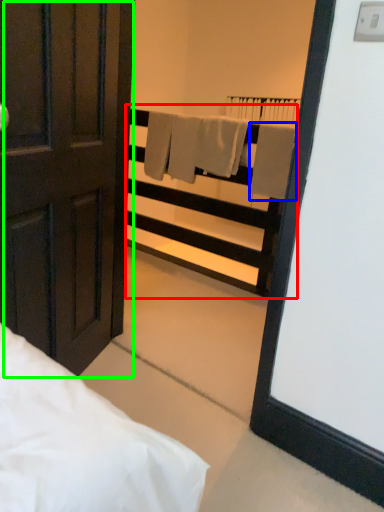
Question: Estimate the real-world distances between objects in this image. Which object is farther from balustrade (highlighted by a red box), bath towel (highlighted by a blue box) or door (highlighted by a green box)?

Choices:
 (A) bath towel
 (B) door

Answer: (B)